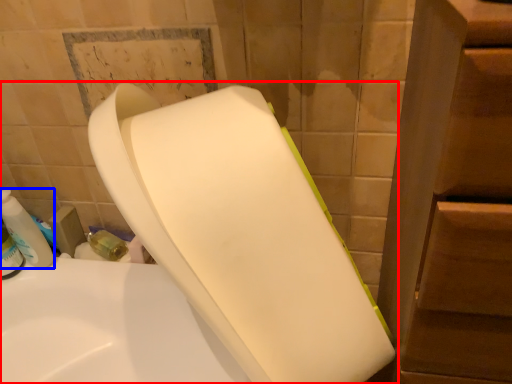
Question: Among these objects, which one is nearest to the camera, toilet (highlighted by a red box) or cleaning product (highlighted by a blue box)?

Choices:
 (A) toilet
 (B) cleaning product

Answer: (A)